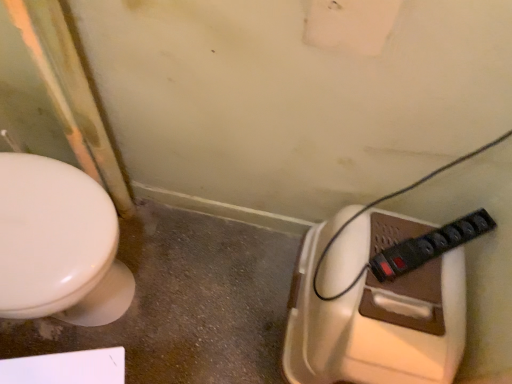
Image resolution: width=512 pixels, height=384 pixels. In order to click on brown plastic toilet at lower right in this screenshot , I will do `click(375, 322)`.

What do you see at coordinates (375, 322) in the screenshot? I see `brown plastic toilet at lower right` at bounding box center [375, 322].

Locate an element on the screen. black plastic power strip at lower right is located at coordinates (429, 246).

This screenshot has height=384, width=512. What do you see at coordinates (429, 246) in the screenshot? I see `black plastic power strip at lower right` at bounding box center [429, 246].

This screenshot has width=512, height=384. In order to click on brown plastic toilet at lower right in this screenshot , I will do `click(375, 322)`.

Based on the photo, between black plastic power strip at lower right and brown plastic toilet at lower right, which one appears on the left side from the viewer's perspective?

brown plastic toilet at lower right.

Does black plastic power strip at lower right come behind brown plastic toilet at lower right?

Yes, the depth of black plastic power strip at lower right is greater than that of brown plastic toilet at lower right.

Which is closer to the camera, (383, 264) or (332, 356)?

Positioned in front is point (383, 264).

From the image's perspective, is black plastic power strip at lower right under brown plastic toilet at lower right?

No, from the image's perspective, black plastic power strip at lower right is not below brown plastic toilet at lower right.

From a real-world perspective, is black plastic power strip at lower right beneath brown plastic toilet at lower right?

Incorrect, from a real-world perspective, black plastic power strip at lower right is higher than brown plastic toilet at lower right.

Considering the sizes of objects black plastic power strip at lower right and brown plastic toilet at lower right in the image provided, who is wider, black plastic power strip at lower right or brown plastic toilet at lower right?

brown plastic toilet at lower right.

Which of these two, black plastic power strip at lower right or brown plastic toilet at lower right, stands taller?

brown plastic toilet at lower right is taller.

Based on the photo, which of these two, black plastic power strip at lower right or brown plastic toilet at lower right, is smaller?

With smaller size is black plastic power strip at lower right.

Is black plastic power strip at lower right not inside brown plastic toilet at lower right?

Absolutely, black plastic power strip at lower right is external to brown plastic toilet at lower right.

Are black plastic power strip at lower right and brown plastic toilet at lower right far apart?

They are positioned close to each other.

Is black plastic power strip at lower right positioned with its back to brown plastic toilet at lower right?

No, black plastic power strip at lower right is not facing the opposite direction of brown plastic toilet at lower right.

What's the angular difference between black plastic power strip at lower right and brown plastic toilet at lower right's facing directions?

black plastic power strip at lower right and brown plastic toilet at lower right are facing 52.2 degrees away from each other.

Image resolution: width=512 pixels, height=384 pixels. Find the location of `toilet that appears below the black plastic power strip at lower right (from the image's perspective)`. toilet that appears below the black plastic power strip at lower right (from the image's perspective) is located at coordinates (375, 322).

Between brown plastic toilet at lower right and black plastic power strip at lower right, which one appears on the right side from the viewer's perspective?

black plastic power strip at lower right is more to the right.

In the image, is brown plastic toilet at lower right positioned in front of or behind black plastic power strip at lower right?

Clearly, brown plastic toilet at lower right is in front of black plastic power strip at lower right.

Is point (379, 243) closer to viewer compared to point (460, 241)?

That is False.

From the image's perspective, which one is positioned higher, brown plastic toilet at lower right or black plastic power strip at lower right?

black plastic power strip at lower right, from the image's perspective.

From a real-world perspective, is brown plastic toilet at lower right located higher than black plastic power strip at lower right?

No.

Considering the relative sizes of brown plastic toilet at lower right and black plastic power strip at lower right in the image provided, is brown plastic toilet at lower right thinner than black plastic power strip at lower right?

In fact, brown plastic toilet at lower right might be wider than black plastic power strip at lower right.

Based on the photo, which of these two, brown plastic toilet at lower right or black plastic power strip at lower right, stands taller?

With more height is brown plastic toilet at lower right.

Based on their sizes in the image, would you say brown plastic toilet at lower right is bigger or smaller than black plastic power strip at lower right?

Clearly, brown plastic toilet at lower right is larger in size than black plastic power strip at lower right.

Is brown plastic toilet at lower right inside the boundaries of black plastic power strip at lower right, or outside?

brown plastic toilet at lower right is not inside black plastic power strip at lower right, it's outside.

Is brown plastic toilet at lower right in contact with black plastic power strip at lower right?

brown plastic toilet at lower right is not next to black plastic power strip at lower right, and they're not touching.

Is black plastic power strip at lower right at the back of brown plastic toilet at lower right?

brown plastic toilet at lower right is not turned away from black plastic power strip at lower right.

This screenshot has width=512, height=384. Find the location of `toilet on the left of black plastic power strip at lower right`. toilet on the left of black plastic power strip at lower right is located at coordinates (375, 322).

Locate an element on the screen. The height and width of the screenshot is (384, 512). plug lying on the right of brown plastic toilet at lower right is located at coordinates (429, 246).

Identify the location of toilet below the black plastic power strip at lower right (from a real-world perspective). (375, 322).